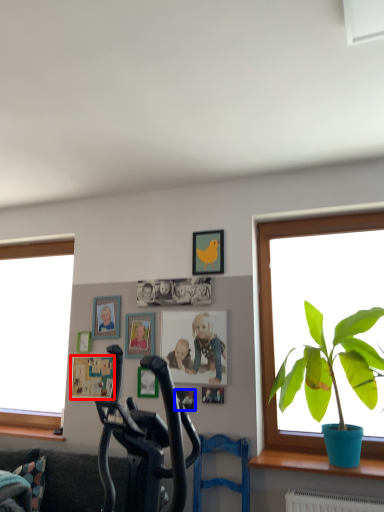
Question: Which object is closer to the camera taking this photo, picture frame (highlighted by a red box) or picture frame (highlighted by a blue box)?

Choices:
 (A) picture frame
 (B) picture frame

Answer: (B)